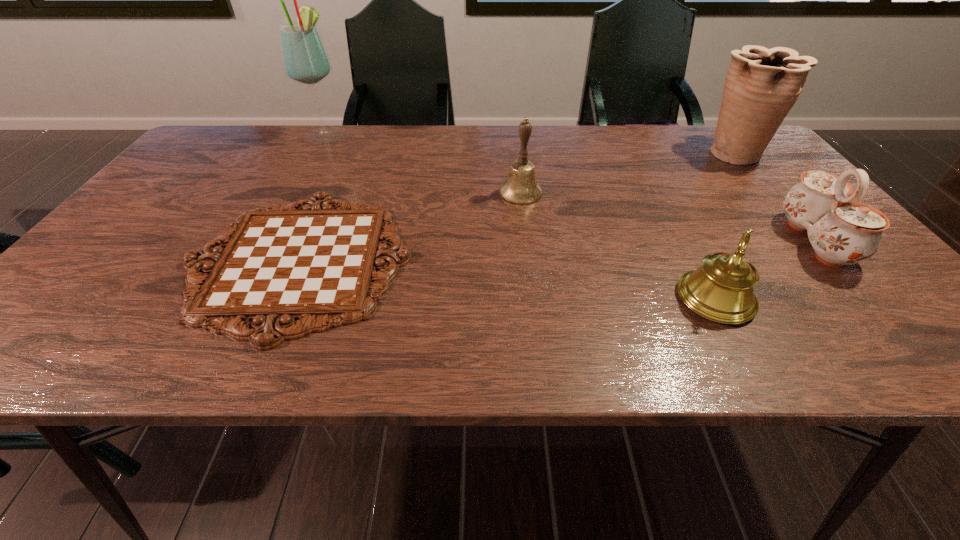
Image resolution: width=960 pixels, height=540 pixels. Find the location of `free spot located 0.190m on the front of the left bell`. free spot located 0.190m on the front of the left bell is located at coordinates (528, 256).

The width and height of the screenshot is (960, 540). I want to click on vacant area situated 0.230m by the handle of the chinaware, so click(686, 241).

Identify the location of vacant space located by the handle of the chinaware. (717, 241).

I want to click on free spot located by the handle of the chinaware, so click(739, 241).

Identify the location of vacant position located on the back of the right bell. (660, 192).

Find the location of a particular element. This screenshot has height=540, width=960. vacant space situated 0.140m on the left of the chessboard is located at coordinates (122, 260).

Locate an element on the screen. Image resolution: width=960 pixels, height=540 pixels. alcohol that is at the far edge is located at coordinates (305, 60).

At what (x,y) coordinates should I click in order to perform the action: click on urn positioned at the far edge. Please return your answer as a coordinate pair (x, y). The image size is (960, 540). Looking at the image, I should click on (762, 85).

The image size is (960, 540). Identify the location of bell that is positioned at the near edge. (721, 290).

I want to click on chessboard positioned at the near edge, so click(x=305, y=260).